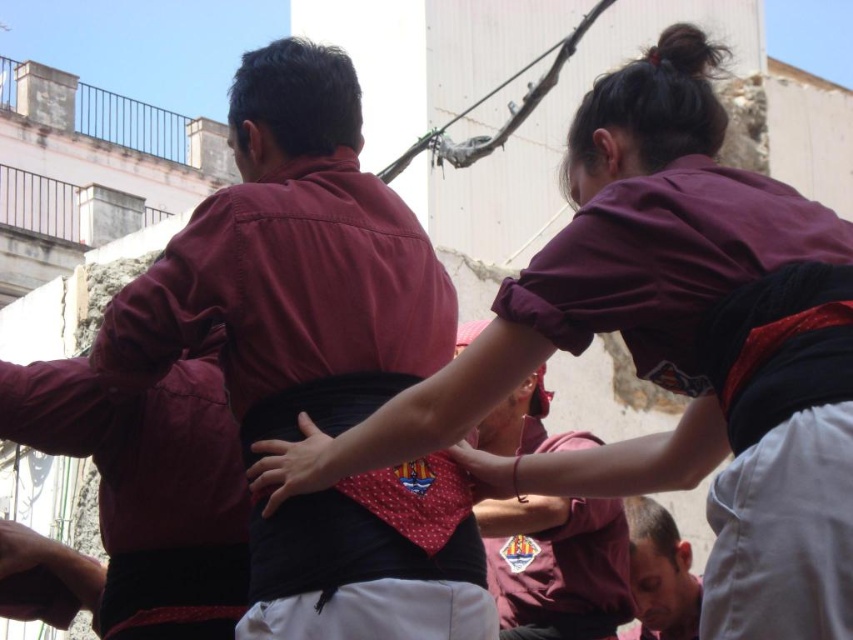
Based on the photo, you are part of the crowd watching the human tower formation. You notice the matte red shirt at center and the smooth skin hand at center. Which object is positioned to the left in the image?

The matte red shirt at center is to the left of the smooth skin hand at center according to the description.

You are a photographer taking a picture of the human tower formation. You notice the smooth skin face at lower center and the polka dot fabric hand at center. Which object is located to the right of the other?

→ The smooth skin face at lower center is positioned on the right side of polka dot fabric hand at center.

You are standing at the base of the human tower formation. There is a point at coordinates point [680,596] that you want to reach. Can you estimate whether this point is within your immediate vicinity or far away?

The point [680,596] is 143.97 feet away from you, so it is far away and not within your immediate vicinity.